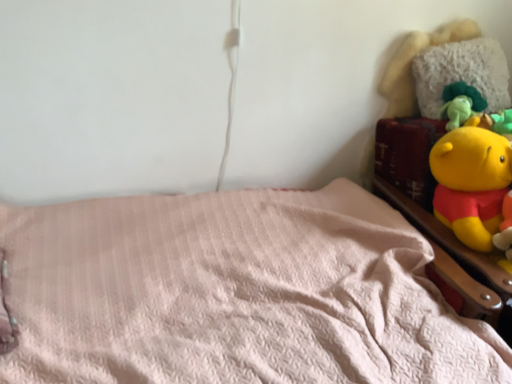
Question: Is pink fluffy blanket at lower left taller or shorter than fluffy white pillow at upper right?

Choices:
 (A) short
 (B) tall

Answer: (B)

Question: From a real-world perspective, is pink fluffy blanket at lower left physically located above or below fluffy white pillow at upper right?

Choices:
 (A) below
 (B) above

Answer: (A)

Question: Which object is positioned farthest from the pink fluffy blanket at lower left?

Choices:
 (A) wooden bed frame at upper right
 (B) fluffy white pillow at upper right

Answer: (B)

Question: Which object is the closest to the fluffy white pillow at upper right?

Choices:
 (A) pink fluffy blanket at lower left
 (B) wooden bed frame at upper right

Answer: (B)